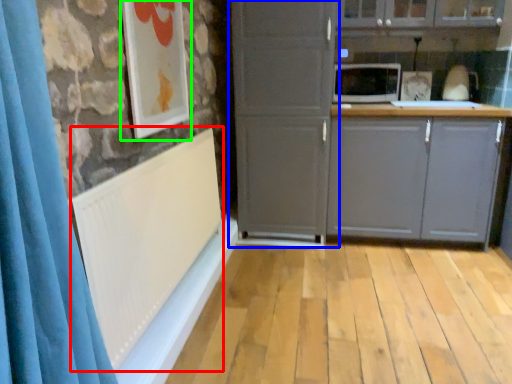
Question: Based on their relative distances, which object is nearer to radiator (highlighted by a red box)? Choose from cupboard (highlighted by a blue box) and picture frame (highlighted by a green box).

Choices:
 (A) cupboard
 (B) picture frame

Answer: (B)